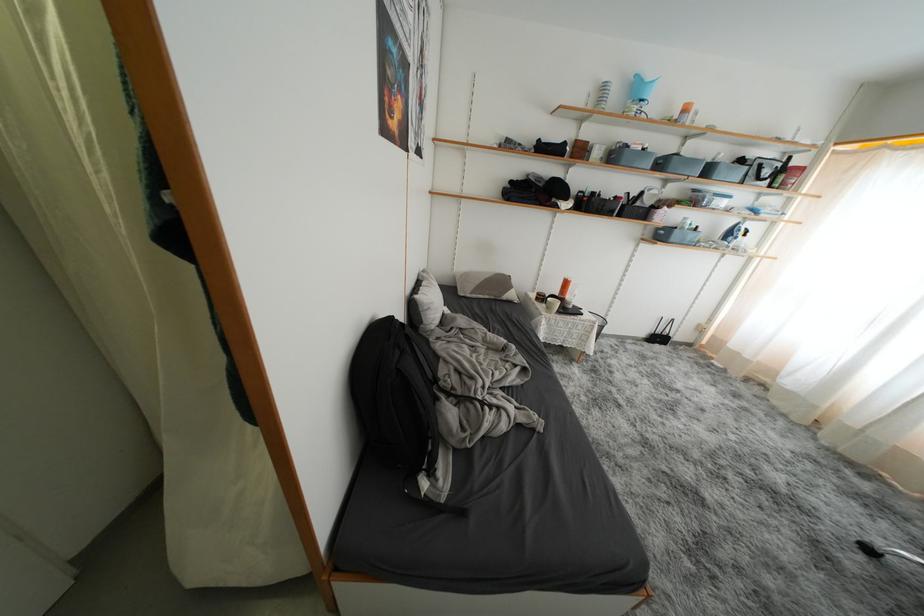
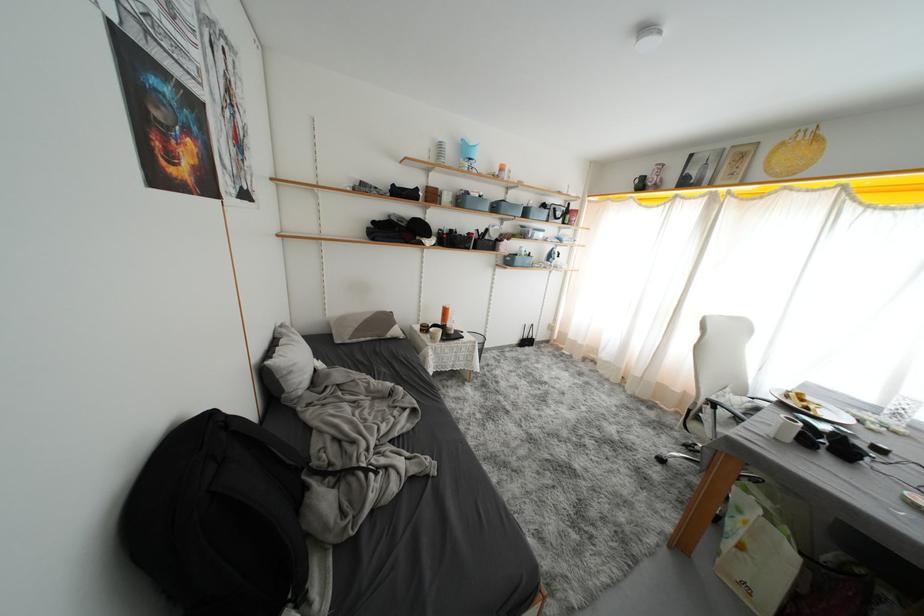
Question: What movement of the cameraman would produce the second image?

Choices:
 (A) Left
 (B) Right
 (C) Forward
 (D) Backward

Answer: (B)